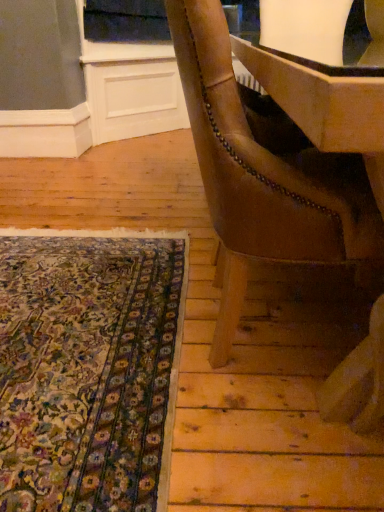
Question: Considering their positions, is floral carpet at lower left located in front of or behind leather at right?

Choices:
 (A) behind
 (B) front

Answer: (A)

Question: Considering the positions of floral carpet at lower left and leather at right in the image, is floral carpet at lower left bigger or smaller than leather at right?

Choices:
 (A) big
 (B) small

Answer: (B)

Question: Is floral carpet at lower left spatially inside leather at right, or outside of it?

Choices:
 (A) outside
 (B) inside

Answer: (A)

Question: Choose the correct answer: Is leather at right inside floral carpet at lower left or outside it?

Choices:
 (A) outside
 (B) inside

Answer: (A)

Question: Considering the positions of leather at right and floral carpet at lower left in the image, is leather at right taller or shorter than floral carpet at lower left?

Choices:
 (A) tall
 (B) short

Answer: (A)

Question: Does point (375, 220) appear closer or farther from the camera than point (120, 432)?

Choices:
 (A) farther
 (B) closer

Answer: (B)

Question: Is leather at right bigger or smaller than floral carpet at lower left?

Choices:
 (A) small
 (B) big

Answer: (B)